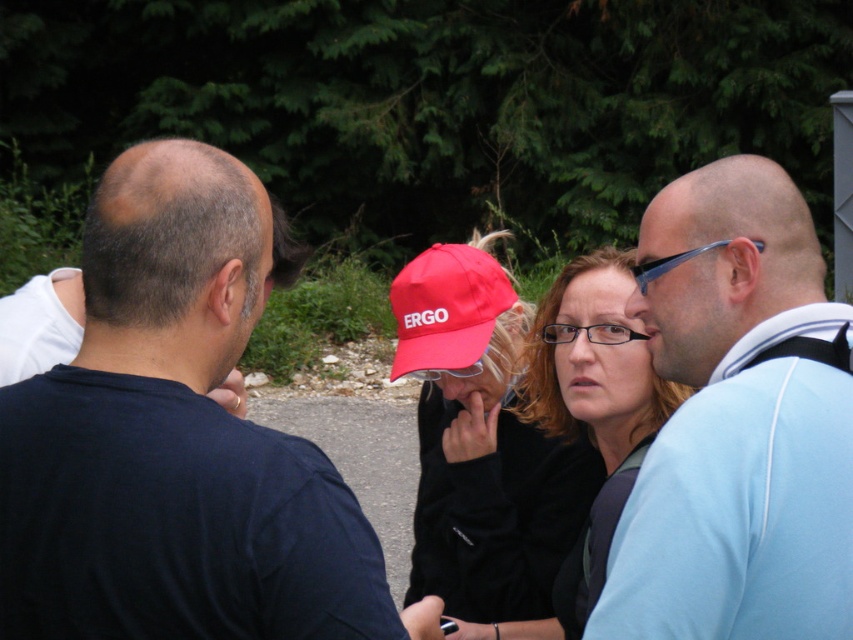
You are a photographer aiming to capture a group photo of the light blue fabric shirt at right and the black matte jacket at center. To ensure both subjects are in focus, you need to adjust your camera settings. Considering their positions, which subject should you focus on to maximize clarity for both?

You should focus on the black matte jacket at center because it is closer to the camera than the light blue fabric shirt at right, which is positioned above it. By focusing on the closer subject, the depth of field will naturally include the farther one more effectively.